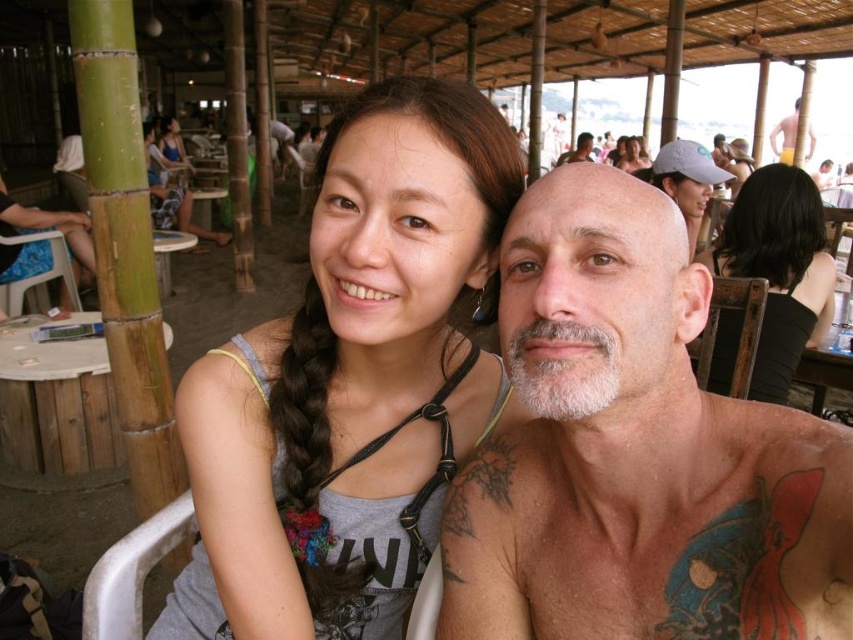
Question: Which object is the closest to the brown hair at upper left?

Choices:
 (A) bald head at center
 (B) smooth yellow towel at upper right

Answer: (A)

Question: Which point is farther from the camera taking this photo?

Choices:
 (A) (161, 132)
 (B) (181, 227)
 (C) (558, 364)

Answer: (A)

Question: Is black hair at upper center positioned at the back of matte gray tank top at upper center?

Choices:
 (A) yes
 (B) no

Answer: (B)

Question: Does bald man with tattoos at center come behind bald head at center?

Choices:
 (A) yes
 (B) no

Answer: (B)

Question: Is smooth yellow towel at upper right in front of bald head at center?

Choices:
 (A) no
 (B) yes

Answer: (A)

Question: Which of the following is the farthest from the observer?

Choices:
 (A) (412, 284)
 (B) (547, 476)
 (C) (645, 163)
 (D) (157, 148)

Answer: (D)